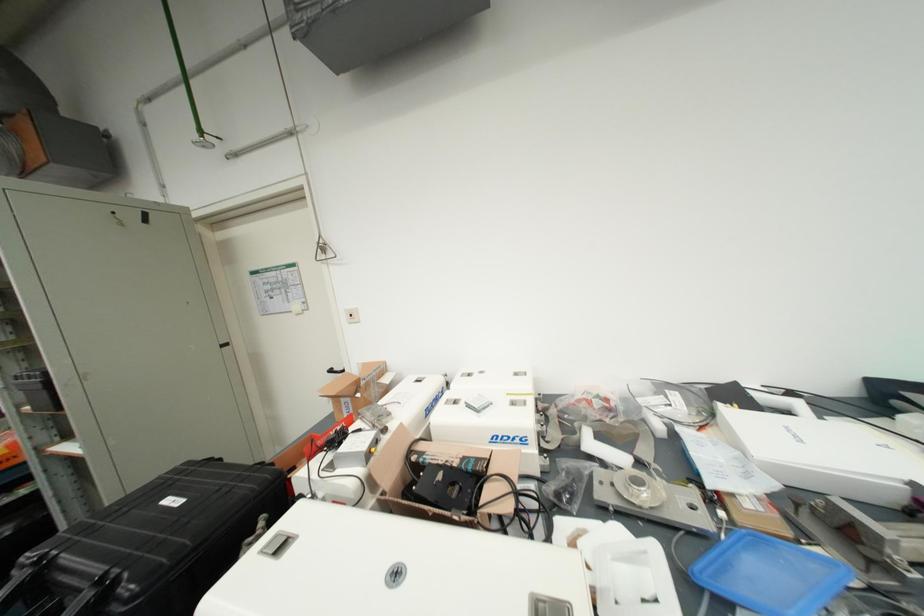
Locate an element on the screen. The width and height of the screenshot is (924, 616). black case handle is located at coordinates (66, 594).